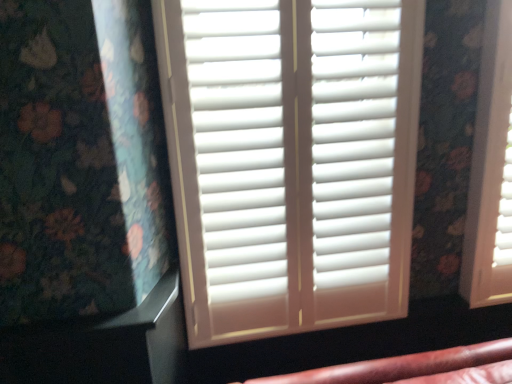
Question: Should I look upward or downward to see white matte shutters at center?

Choices:
 (A) down
 (B) up

Answer: (B)